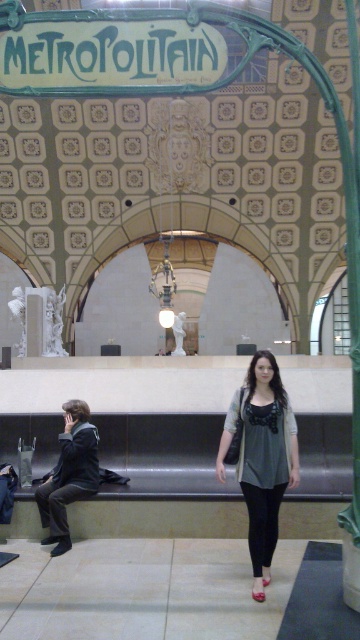
Question: Does matte gray blouse at center have a smaller size compared to dark gray fabric jacket at left?

Choices:
 (A) yes
 (B) no

Answer: (B)

Question: Which of the following is the closest to the observer?

Choices:
 (A) (225, 422)
 (B) (72, 413)

Answer: (A)

Question: Which object appears closest to the camera in this image?

Choices:
 (A) dark gray fabric jacket at left
 (B) matte gray blouse at center

Answer: (B)

Question: Does matte gray blouse at center have a smaller size compared to dark gray fabric jacket at left?

Choices:
 (A) yes
 (B) no

Answer: (B)

Question: Does matte gray blouse at center appear on the right side of dark gray fabric jacket at left?

Choices:
 (A) no
 (B) yes

Answer: (B)